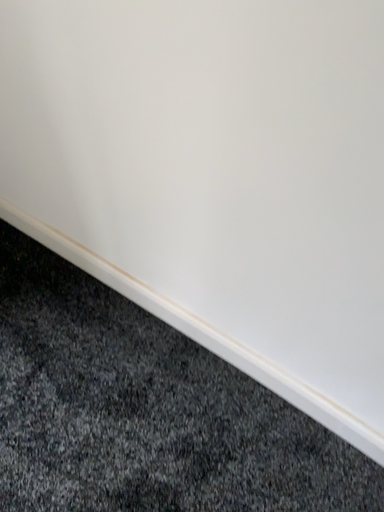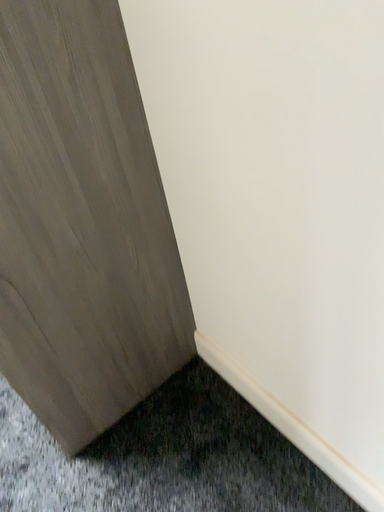
Question: How did the camera likely rotate when shooting the video?

Choices:
 (A) rotated upward
 (B) rotated downward

Answer: (A)